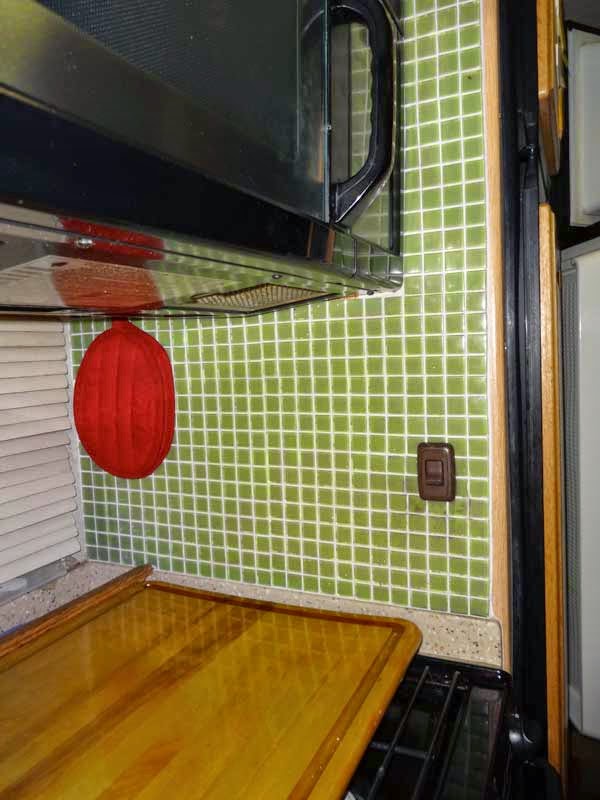
You are a GUI agent. You are given a task and a screenshot of the screen. Output one action in this format:
    pyautogui.click(x=<x>, y=<y>)
    Task: Click on the blinds
    The image size is (600, 800).
    Given the screenshot: What is the action you would take?
    pyautogui.click(x=36, y=446)